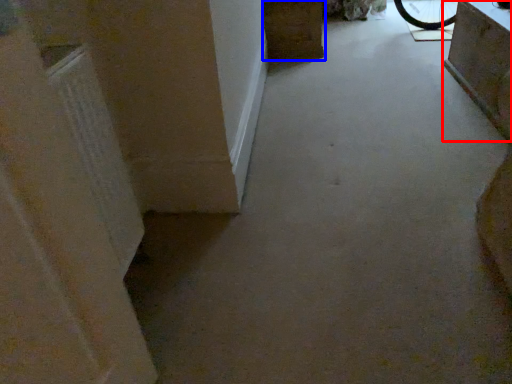
Question: Which of the following is the closest to the observer, furniture (highlighted by a red box) or furniture (highlighted by a blue box)?

Choices:
 (A) furniture
 (B) furniture

Answer: (A)